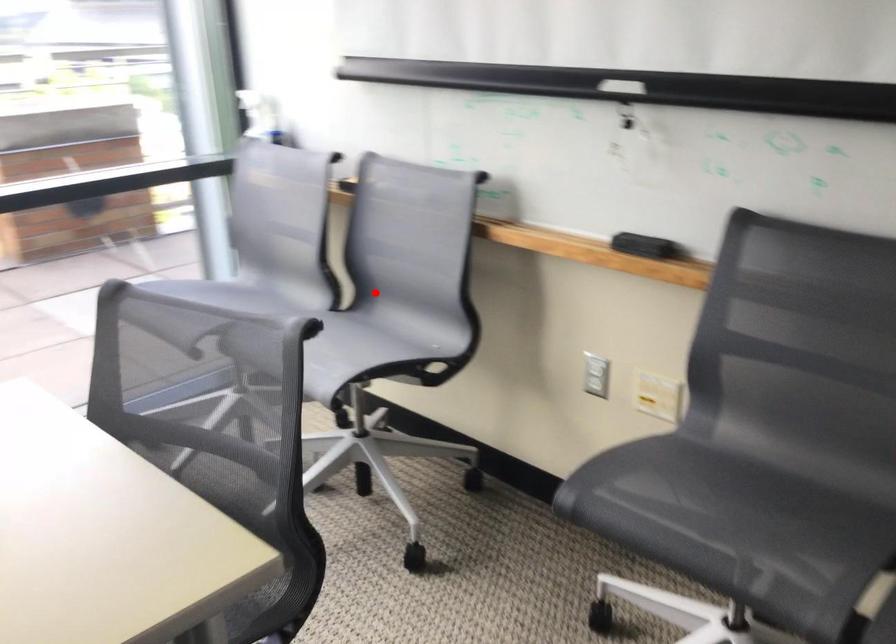
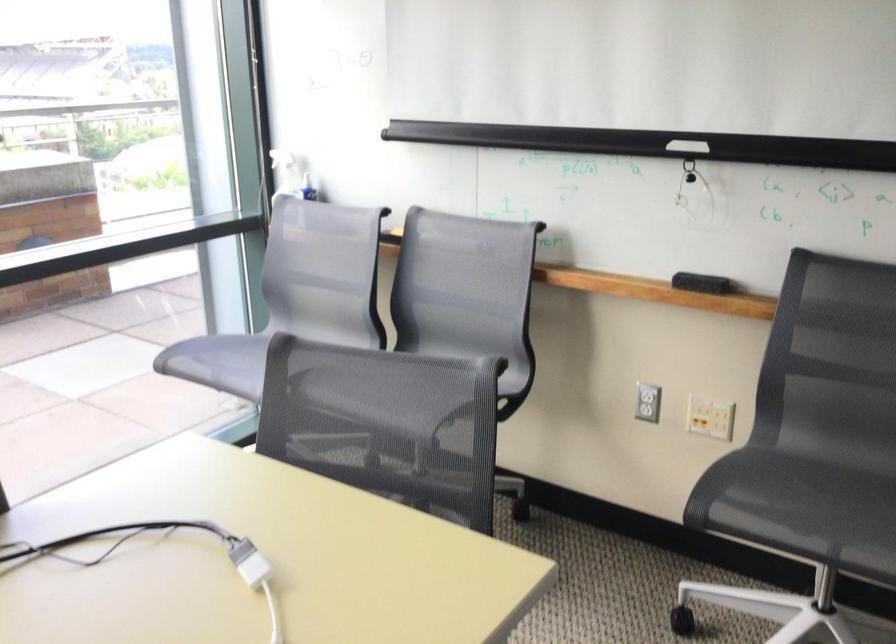
In the second image, find the point that corresponds to the highlighted location in the first image.

(426, 337)